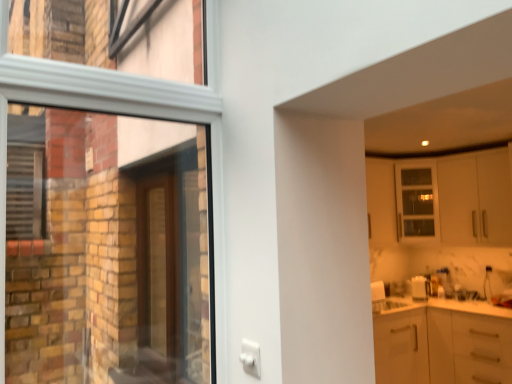
Question: Based on their positions, is white matte cabinet at upper right located to the left or right of brown wooden door at left?

Choices:
 (A) left
 (B) right

Answer: (B)

Question: Is white matte cabinet at upper right bigger or smaller than brown wooden door at left?

Choices:
 (A) small
 (B) big

Answer: (B)

Question: Relative to brown wooden door at left, is white matte cabinet at upper right in front or behind?

Choices:
 (A) front
 (B) behind

Answer: (B)

Question: In terms of size, does brown wooden door at left appear bigger or smaller than white matte cabinet at upper right?

Choices:
 (A) big
 (B) small

Answer: (B)

Question: Considering the positions of brown wooden door at left and white matte cabinet at upper right in the image, is brown wooden door at left wider or thinner than white matte cabinet at upper right?

Choices:
 (A) thin
 (B) wide

Answer: (A)

Question: Would you say brown wooden door at left is inside or outside white matte cabinet at upper right?

Choices:
 (A) inside
 (B) outside

Answer: (B)

Question: In the image, is brown wooden door at left on the left side or the right side of white matte cabinet at upper right?

Choices:
 (A) right
 (B) left

Answer: (B)